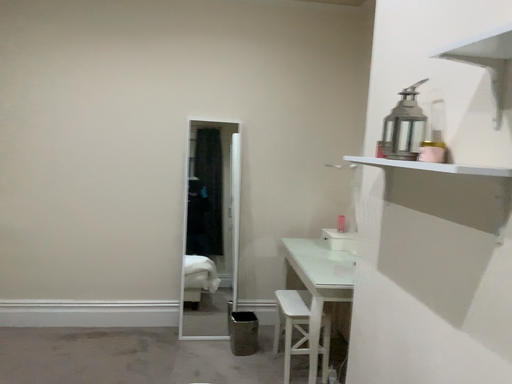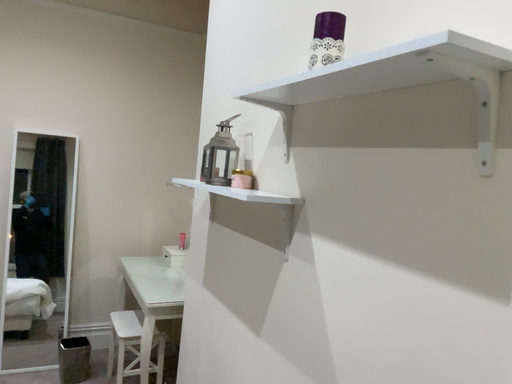
Question: How did the camera likely rotate when shooting the video?

Choices:
 (A) rotated left
 (B) rotated right

Answer: (B)